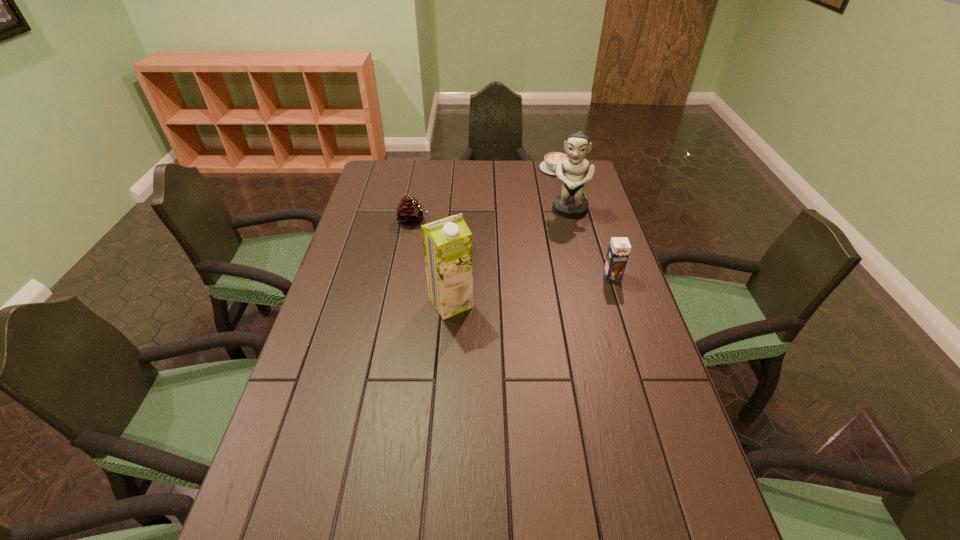
Find the location of `vacant region located 0.260m on the front label of the third tallest object`. vacant region located 0.260m on the front label of the third tallest object is located at coordinates (636, 349).

I want to click on vacant region located 0.340m on the front-facing side of the figurine, so click(548, 284).

You are a GUI agent. You are given a task and a screenshot of the screen. Output one action in this format:
    pyautogui.click(x=<x>, y=<y>)
    Task: Click on the vacant space positioned on the front-facing side of the figurine
    The image size is (960, 540).
    Given the screenshot: What is the action you would take?
    pyautogui.click(x=562, y=238)

The width and height of the screenshot is (960, 540). I want to click on free space located on the front-facing side of the figurine, so click(x=549, y=279).

Locate an element on the screen. The height and width of the screenshot is (540, 960). vacant space located on the side of the shortest object with the handle is located at coordinates (546, 200).

At what (x,y) coordinates should I click in order to perform the action: click on vacant position located 0.360m on the side of the shortest object with the handle. Please return your answer as a coordinate pair (x, y). This screenshot has width=960, height=540. Looking at the image, I should click on (538, 228).

Identify the location of vacant space situated 0.360m on the side of the shortest object with the handle. This screenshot has height=540, width=960. (538, 228).

This screenshot has height=540, width=960. I want to click on blank area located with a leaf charm attached to the fourth tallest object, so click(x=501, y=277).

Where is `blank area located 0.110m with a leaf charm attached to the fourth tallest object`? The image size is (960, 540). blank area located 0.110m with a leaf charm attached to the fourth tallest object is located at coordinates (445, 240).

At what (x,y) coordinates should I click in order to perform the action: click on free space located 0.150m with a leaf charm attached to the fourth tallest object. Please return your answer as a coordinate pair (x, y). This screenshot has width=960, height=540. Looking at the image, I should click on (453, 246).